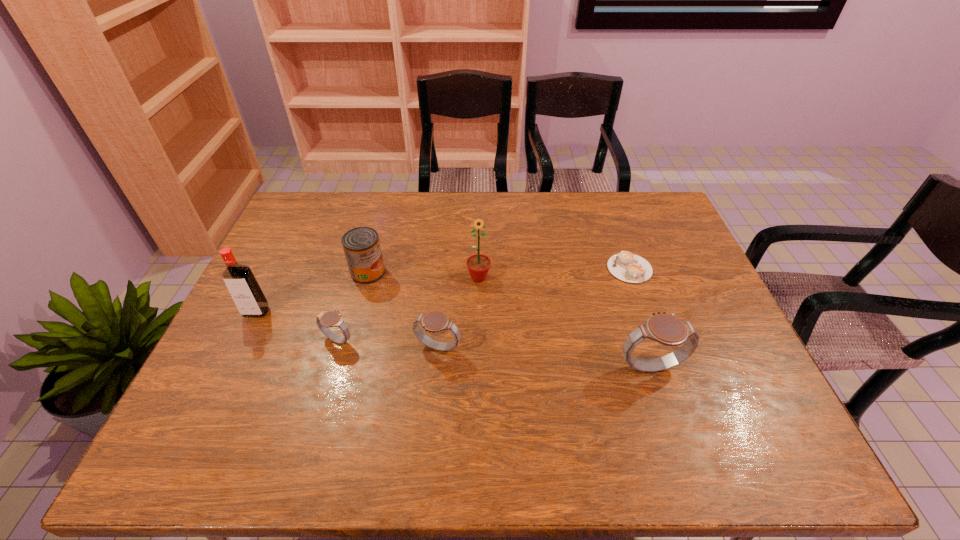
Please point a location where one more watch can be added evenly. Please provide its 2D coordinates. Your answer should be formatted as a tuple, i.e. [(x, y)], where the tuple contains the x and y coordinates of a point satisfying the conditions above.

[(542, 357)]